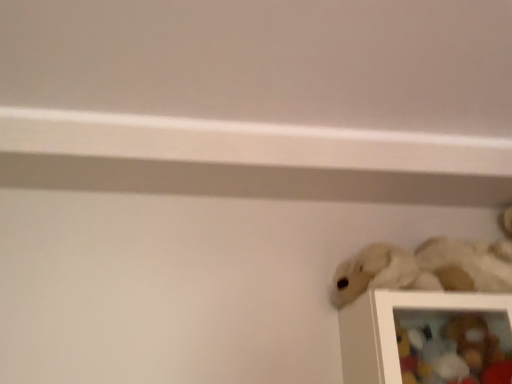
Question: In the image, is soft plush toy at lower right, the first toy when ordered from bottom to top, positioned in front of or behind white plush toy at lower right, which is the 2th toy in top-to-bottom order?

Choices:
 (A) behind
 (B) front

Answer: (A)

Question: Looking at their shapes, would you say soft plush toy at lower right, which appears as the third toy when viewed from the top, is wider or thinner than white plush toy at lower right, which is the 2th toy in top-to-bottom order?

Choices:
 (A) wide
 (B) thin

Answer: (B)

Question: Based on their relative distances, which object is nearer to the fuzzy white stuffed animal at lower right, the 3th toy from the bottom?

Choices:
 (A) white plush toy at lower right, which is the 2th toy in top-to-bottom order
 (B) soft plush toy at lower right, which appears as the third toy when viewed from the top

Answer: (B)

Question: Estimate the real-world distances between objects in this image. Which object is farther from the soft plush toy at lower right, which appears as the third toy when viewed from the top?

Choices:
 (A) fuzzy white stuffed animal at lower right, acting as the first toy starting from the top
 (B) white plush toy at lower right, placed as the 2th toy when sorted from bottom to top

Answer: (A)